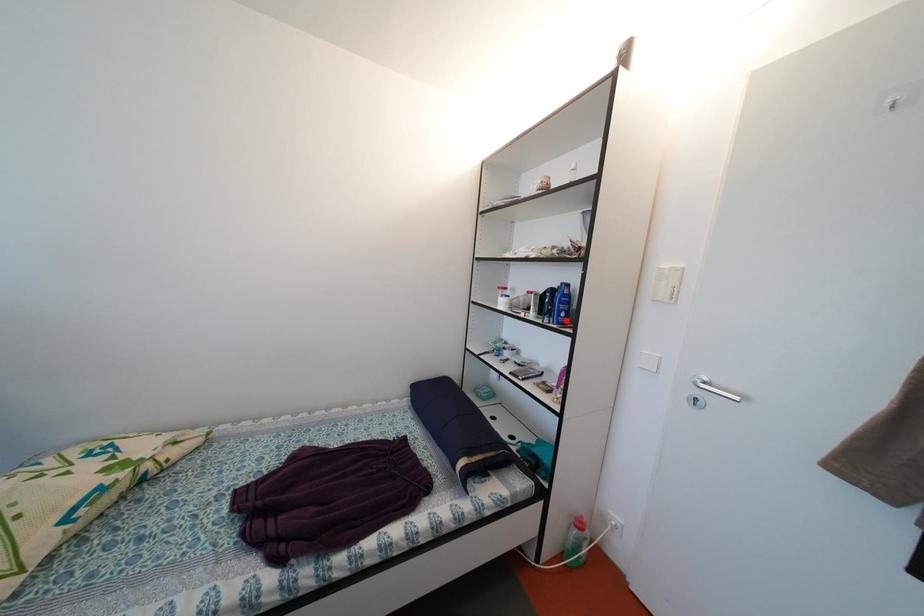
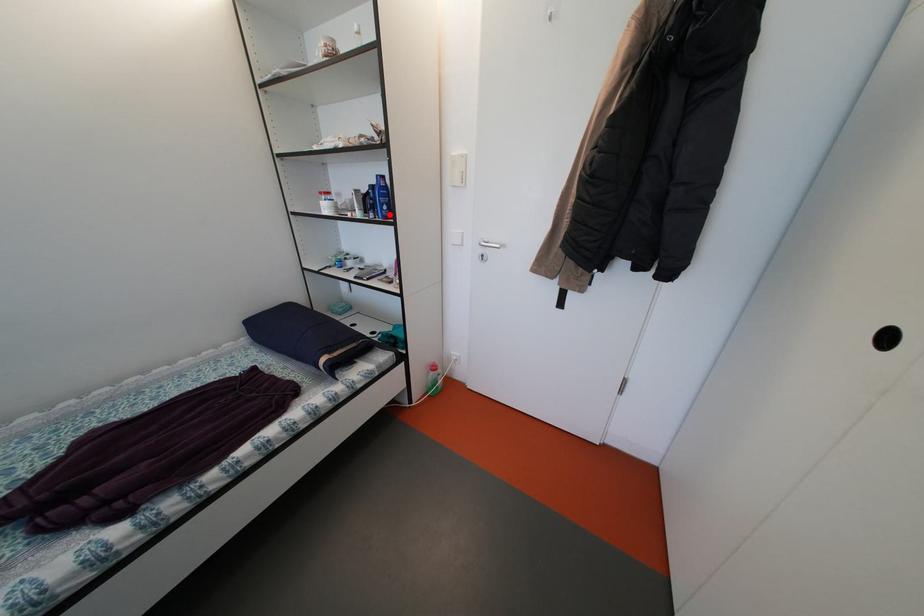
I am providing you with two images of the same scene from different viewpoints. A red point is marked on the first image and another point is marked on the second image. Does the point marked in image1 correspond to the same location as the one in image2?

Yes